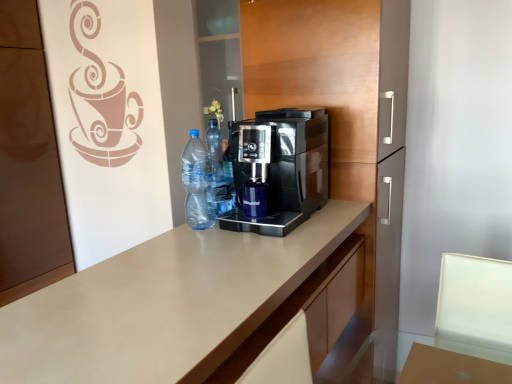
Question: Does transparent plastic bottle at center, which is the first bottle in front-to-back order, have a larger size compared to black glossy coffee machine at center?

Choices:
 (A) no
 (B) yes

Answer: (A)

Question: Does transparent plastic bottle at center, positioned as the second bottle in back-to-front order, come behind black glossy coffee machine at center?

Choices:
 (A) no
 (B) yes

Answer: (A)

Question: Is transparent plastic bottle at center, which is the first bottle in front-to-back order, in contact with black glossy coffee machine at center?

Choices:
 (A) yes
 (B) no

Answer: (B)

Question: Is transparent plastic bottle at center, positioned as the second bottle in back-to-front order, aimed at black glossy coffee machine at center?

Choices:
 (A) no
 (B) yes

Answer: (A)

Question: Does transparent plastic bottle at center, positioned as the second bottle in back-to-front order, have a greater height compared to black glossy coffee machine at center?

Choices:
 (A) yes
 (B) no

Answer: (B)

Question: Is transparent plastic bottle at center, which is the first bottle in front-to-back order, wider than black glossy coffee machine at center?

Choices:
 (A) no
 (B) yes

Answer: (A)

Question: Does translucent plastic bottles at center, which is the first bottle in back-to-front order, turn towards transparent glass table at lower right?

Choices:
 (A) yes
 (B) no

Answer: (B)

Question: Can you confirm if translucent plastic bottles at center, which is the first bottle in back-to-front order, is bigger than transparent glass table at lower right?

Choices:
 (A) yes
 (B) no

Answer: (B)

Question: From the image's perspective, would you say translucent plastic bottles at center, which is the first bottle in back-to-front order, is shown under transparent glass table at lower right?

Choices:
 (A) yes
 (B) no

Answer: (B)

Question: Is translucent plastic bottles at center, which is the first bottle in back-to-front order, in contact with transparent glass table at lower right?

Choices:
 (A) yes
 (B) no

Answer: (B)

Question: Does translucent plastic bottles at center, which is the first bottle in back-to-front order, lie behind transparent glass table at lower right?

Choices:
 (A) no
 (B) yes

Answer: (B)

Question: From the image's perspective, is translucent plastic bottles at center, which is the first bottle in back-to-front order, on top of transparent glass table at lower right?

Choices:
 (A) yes
 (B) no

Answer: (A)

Question: Does transparent plastic bottle at center, positioned as the second bottle in back-to-front order, have a greater height compared to translucent plastic bottles at center, which is the first bottle in back-to-front order?

Choices:
 (A) yes
 (B) no

Answer: (B)